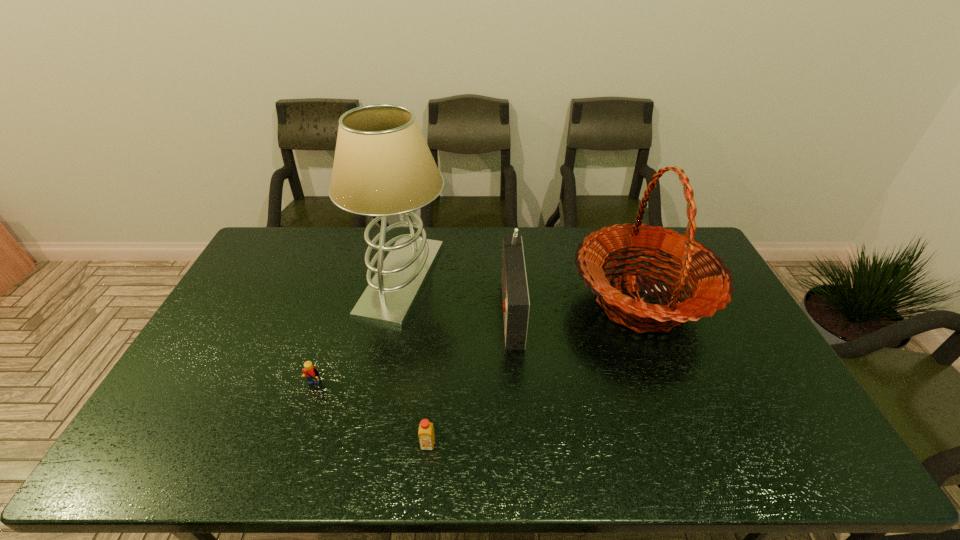
Find the location of a particular element. vacant space at the far edge of the desktop is located at coordinates point(502,246).

Image resolution: width=960 pixels, height=540 pixels. What are the coordinates of `vacant space at the near edge of the desktop` in the screenshot? It's located at (x=682, y=445).

The image size is (960, 540). In the image, there is a desktop. Identify the location of vacant space at the left edge. pyautogui.click(x=201, y=375).

Where is `vacant space at the right edge of the desktop`? This screenshot has height=540, width=960. vacant space at the right edge of the desktop is located at coordinates (728, 325).

Where is `vacant space that's between the fourth tallest object and the nearest object`? This screenshot has height=540, width=960. vacant space that's between the fourth tallest object and the nearest object is located at coordinates (371, 417).

The height and width of the screenshot is (540, 960). Find the location of `free space between the tallest object and the fourth tallest object`. free space between the tallest object and the fourth tallest object is located at coordinates (357, 334).

This screenshot has height=540, width=960. In order to click on empty space between the Lego and the rightmost object in this screenshot , I will do `click(476, 346)`.

Where is `empty space that is in between the second tallest object and the Lego`? The height and width of the screenshot is (540, 960). empty space that is in between the second tallest object and the Lego is located at coordinates (476, 346).

Where is `unoccupied area between the fourth tallest object and the tallest object`? The image size is (960, 540). unoccupied area between the fourth tallest object and the tallest object is located at coordinates (357, 334).

At what (x,y) coordinates should I click in order to perform the action: click on vacant space in between the fourth farthest object and the third shortest object. Please return your answer as a coordinate pair (x, y). Looking at the image, I should click on (412, 349).